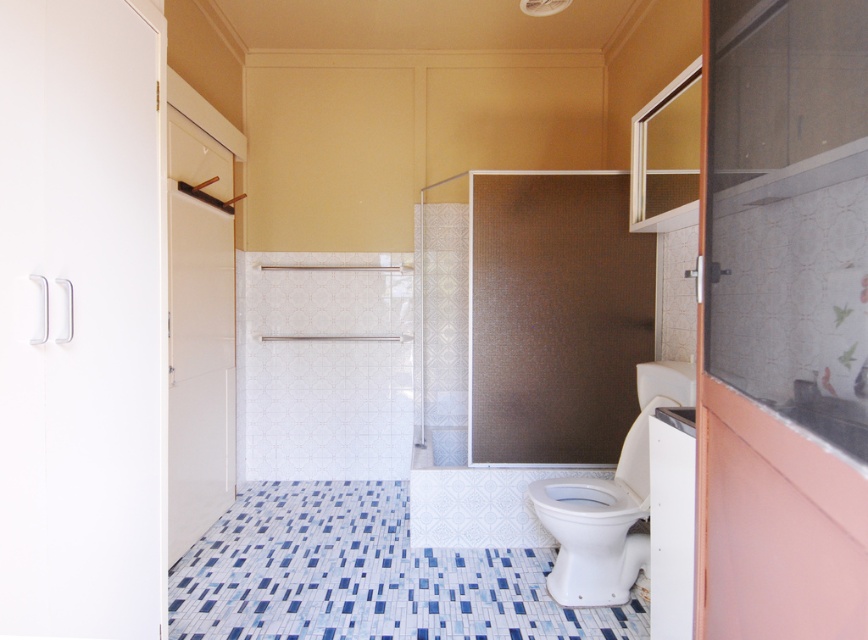
From the picture: Who is lower down, white matte cabinet at left or white glossy sink at upper right?

white glossy sink at upper right is below.

The image size is (868, 640). What are the coordinates of `white matte cabinet at left` in the screenshot? It's located at (80, 321).

At what (x,y) coordinates should I click in order to perform the action: click on white matte cabinet at left. Please return your answer as a coordinate pair (x, y). Looking at the image, I should click on (80, 321).

Can you confirm if white glossy toilet bowl at lower right is thinner than white glossy toilet at lower right?

Incorrect, white glossy toilet bowl at lower right's width is not less than white glossy toilet at lower right's.

Does white glossy toilet bowl at lower right come in front of white glossy toilet at lower right?

Yes, white glossy toilet bowl at lower right is in front of white glossy toilet at lower right.

Find the location of `white glossy toilet bowl at lower right`. white glossy toilet bowl at lower right is located at coordinates (609, 502).

Between blue mosaic tile at lower center and white glossy toilet bowl at lower right, which one is positioned higher?

white glossy toilet bowl at lower right is above.

Is blue mosaic tile at lower center wider than white glossy toilet bowl at lower right?

Yes, blue mosaic tile at lower center is wider than white glossy toilet bowl at lower right.

What are the coordinates of `blue mosaic tile at lower center` in the screenshot? It's located at tap(365, 576).